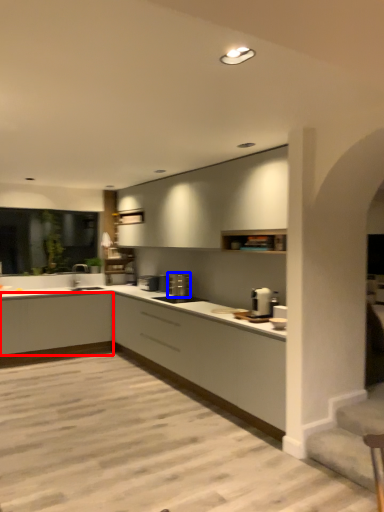
Question: Which of the following is the closest to the observer, cabinetry (highlighted by a red box) or appliance (highlighted by a blue box)?

Choices:
 (A) cabinetry
 (B) appliance

Answer: (B)